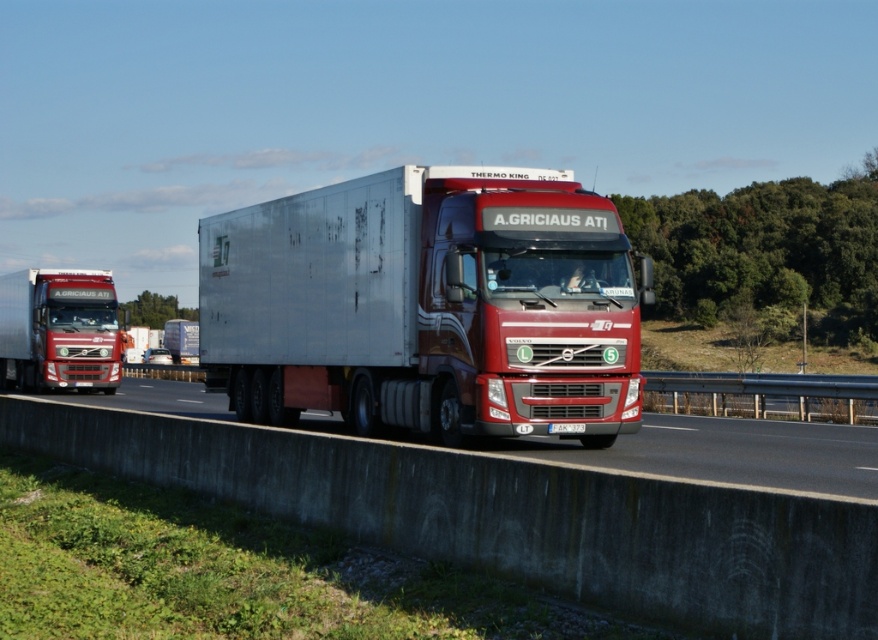
Question: Does silver metallic trailer truck at center have a greater width compared to metallic concrete barrier at center?

Choices:
 (A) no
 (B) yes

Answer: (A)

Question: Is silver metallic trailer truck at center bigger than matte red truck at left?

Choices:
 (A) yes
 (B) no

Answer: (B)

Question: Which object appears farthest from the camera in this image?

Choices:
 (A) silver metallic trailer truck at center
 (B) concrete barrier at center

Answer: (A)

Question: Is concrete barrier at center wider than metallic concrete barrier at center?

Choices:
 (A) yes
 (B) no

Answer: (B)

Question: Which point is farther to the camera?

Choices:
 (A) (846, 445)
 (B) (735, 632)
 (C) (6, 339)

Answer: (C)

Question: Which point appears farthest from the camera in this image?

Choices:
 (A) click(x=184, y=401)
 (B) click(x=84, y=339)
 (C) click(x=231, y=496)

Answer: (B)